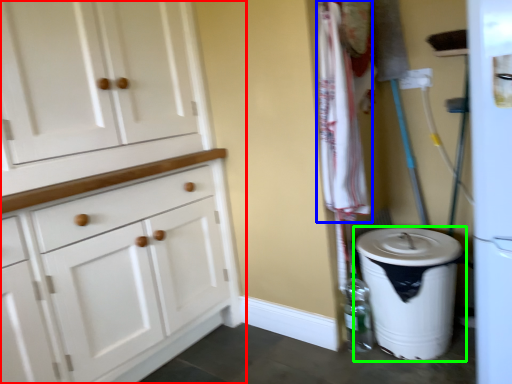
Question: Which is nearer to the cabinetry (highlighted by a red box)? laundry (highlighted by a blue box) or waste container (highlighted by a green box).

Choices:
 (A) laundry
 (B) waste container

Answer: (A)